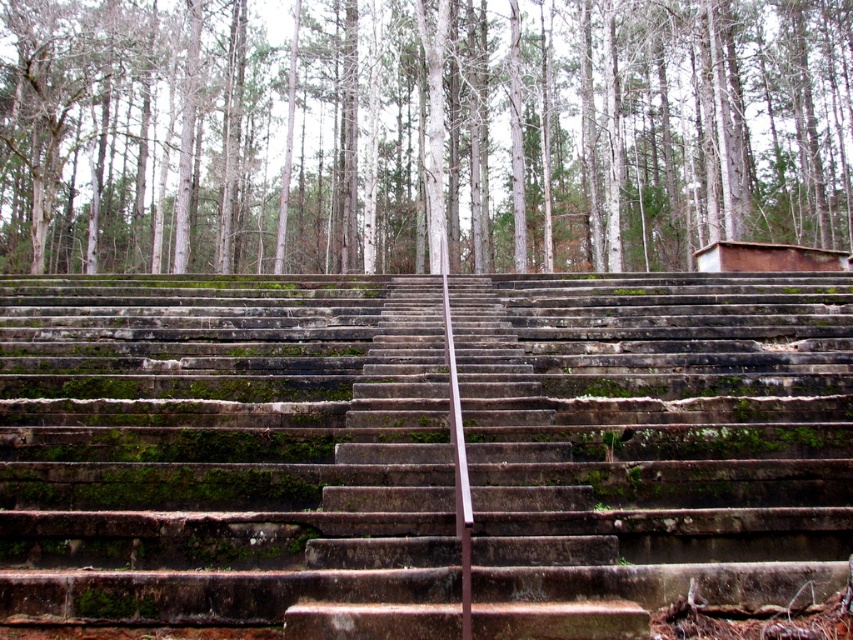
Which of these two, dark gray concrete stairs at center or white bark trees at upper center, stands shorter?

dark gray concrete stairs at center

Is dark gray concrete stairs at center thinner than white bark trees at upper center?

Indeed, dark gray concrete stairs at center has a lesser width compared to white bark trees at upper center.

The image size is (853, 640). I want to click on dark gray concrete stairs at center, so click(224, 458).